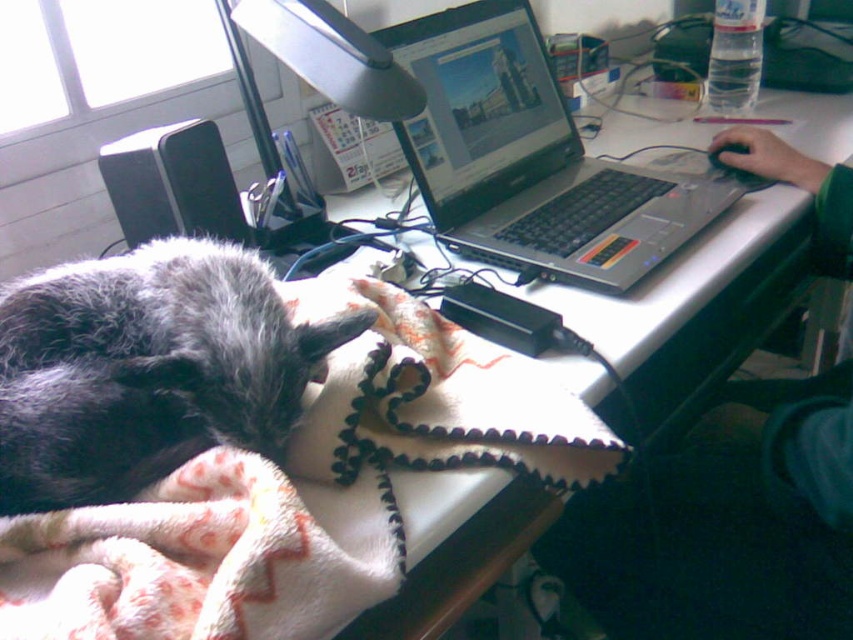
Question: Which object is positioned farthest from the white fleece blanket at lower left?

Choices:
 (A) fluffy gray cat at lower left
 (B) silver/black plastic laptop at center

Answer: (B)

Question: Does white fleece blanket at lower left have a smaller size compared to fluffy gray cat at lower left?

Choices:
 (A) no
 (B) yes

Answer: (B)

Question: Does fluffy gray cat at lower left appear on the right side of silver/black plastic laptop at center?

Choices:
 (A) yes
 (B) no

Answer: (B)

Question: Which point is farther to the camera?

Choices:
 (A) (80, 397)
 (B) (505, 417)

Answer: (B)

Question: Which point appears closest to the camera in this image?

Choices:
 (A) (137, 490)
 (B) (409, 385)
 (C) (496, 13)

Answer: (A)

Question: Does fluffy gray cat at lower left appear on the left side of silver/black plastic laptop at center?

Choices:
 (A) yes
 (B) no

Answer: (A)